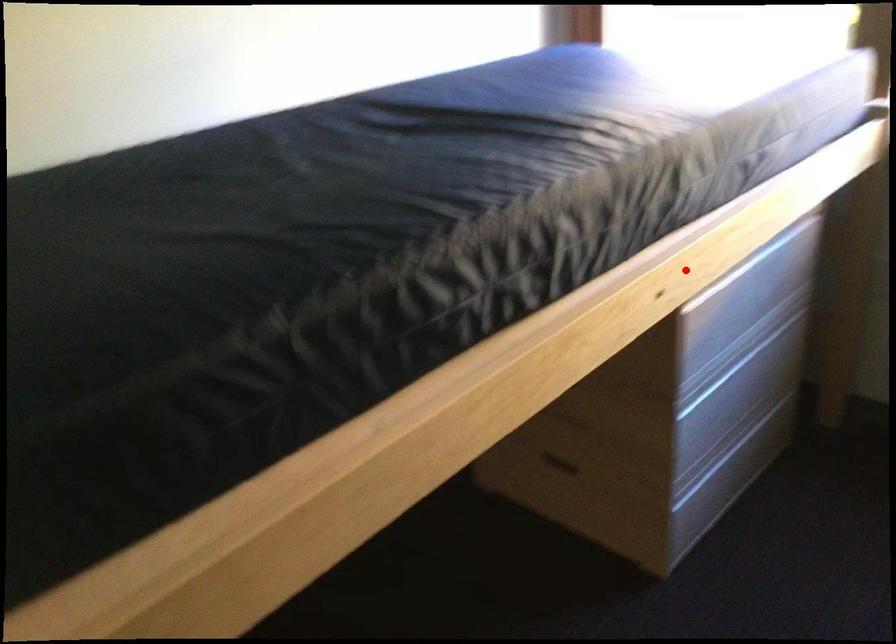
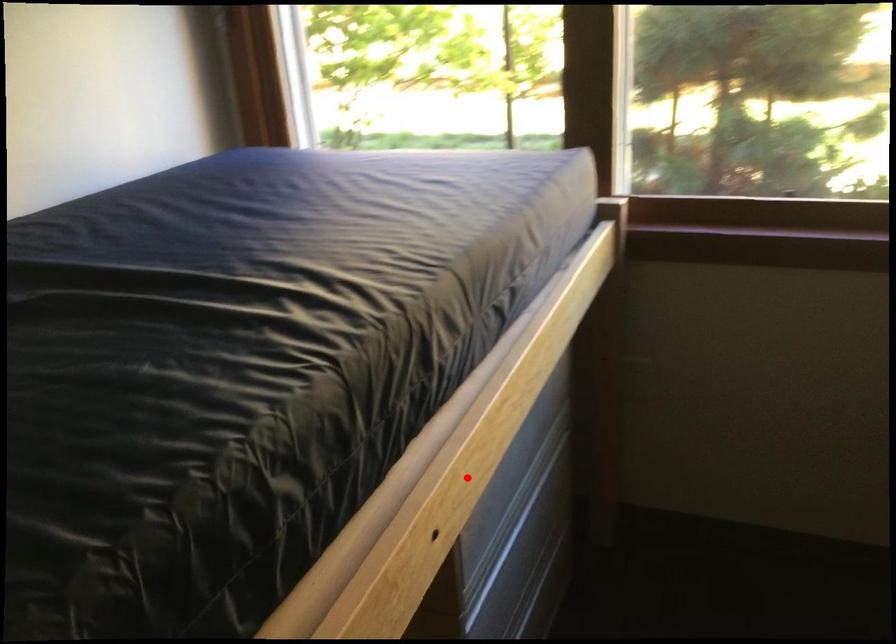
I am providing you with two images of the same scene from different viewpoints. A red point is marked on the first image and another point is marked on the second image. Is the marked point in image1 the same physical position as the marked point in image2?

Yes